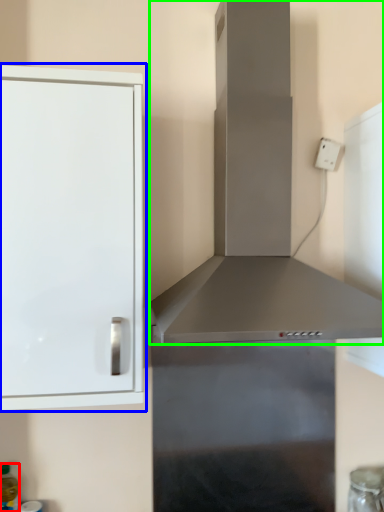
Question: Which object is the closest to the bottle (highlighted by a red box)? Choose among these: cabinetry (highlighted by a blue box) or vent (highlighted by a green box).

Choices:
 (A) cabinetry
 (B) vent

Answer: (A)